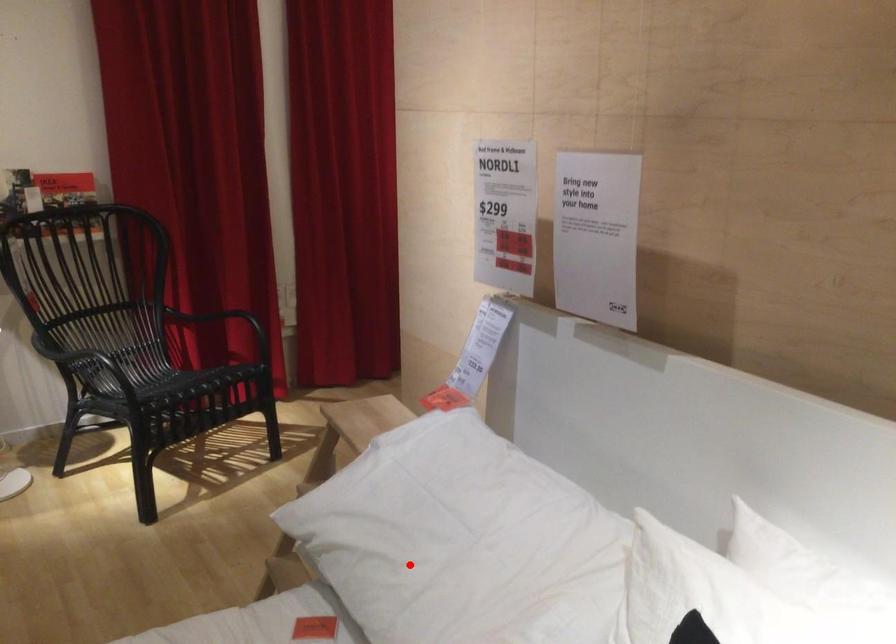
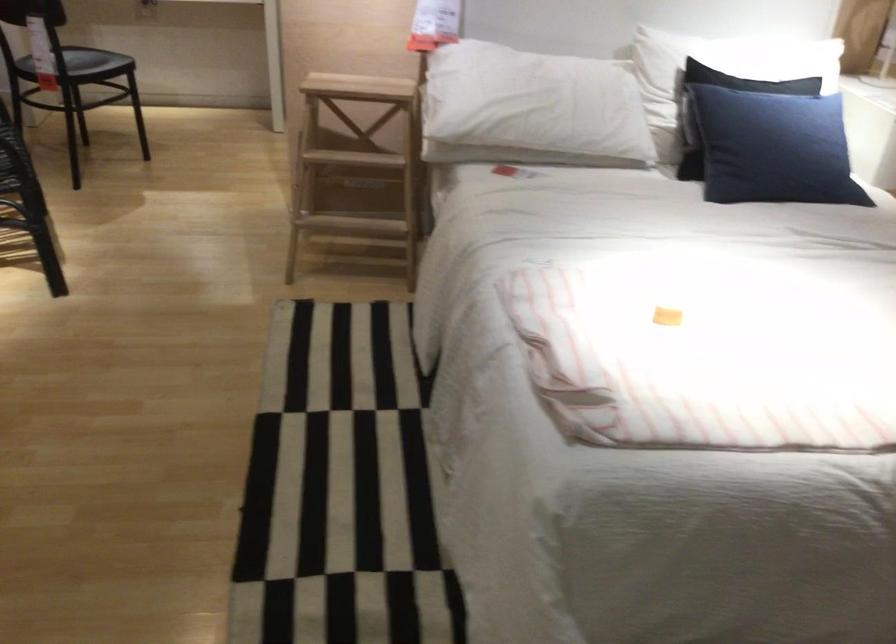
Where in the second image is the point corresponding to the highlighted location from the first image?

(531, 108)